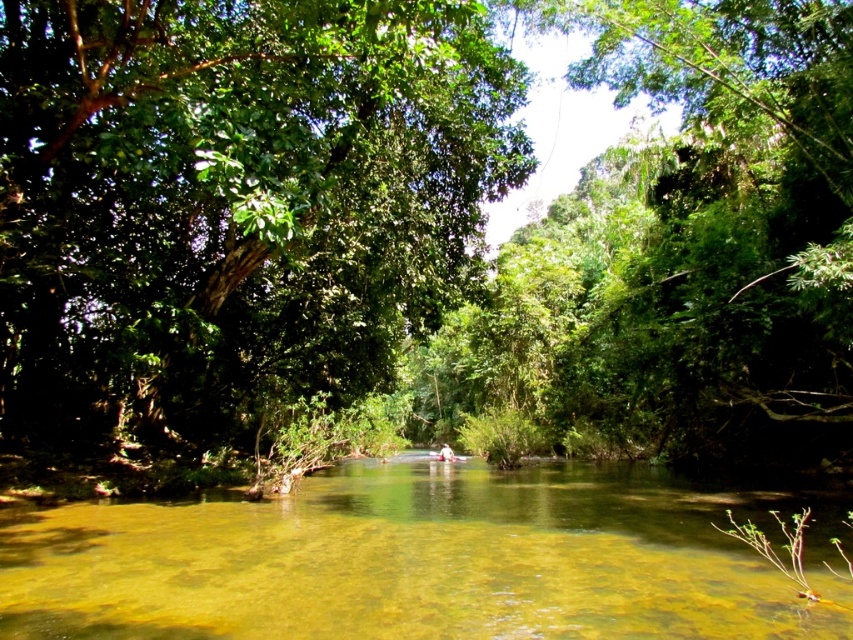
Can you confirm if green leafy tree at center is bigger than clear water at center?

Yes, green leafy tree at center is bigger than clear water at center.

Locate an element on the screen. green leafy tree at center is located at coordinates (233, 202).

Identify the location of green leafy tree at center. The width and height of the screenshot is (853, 640). (233, 202).

Does clear water at center appear under light brown wooden canoe at center?

No.

Does clear water at center appear on the left side of light brown wooden canoe at center?

No, clear water at center is not to the left of light brown wooden canoe at center.

Is point (467, 616) in front of point (456, 458)?

Yes.

Find the location of a particular element. The height and width of the screenshot is (640, 853). clear water at center is located at coordinates (421, 560).

Image resolution: width=853 pixels, height=640 pixels. Identify the location of green leafy tree at center. (233, 202).

The height and width of the screenshot is (640, 853). What are the coordinates of `green leafy tree at center` in the screenshot? It's located at (233, 202).

Where is `green leafy tree at center`? green leafy tree at center is located at coordinates (233, 202).